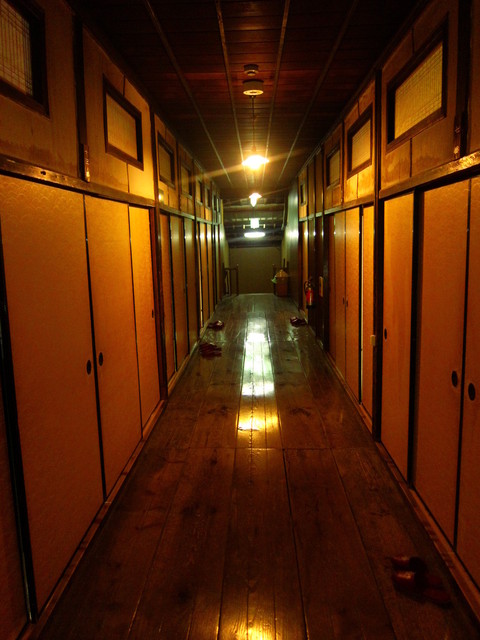
What are the coordinates of `smoke detector` in the screenshot? It's located at (257, 89).